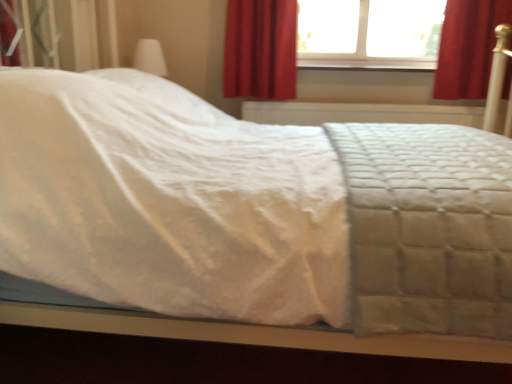
Question: Is the depth of red velvet curtain at upper right, the second curtain when ordered from left to right, less than that of white quilted fabric at center?

Choices:
 (A) no
 (B) yes

Answer: (A)

Question: Considering the relative sizes of red velvet curtain at upper right, the second curtain when ordered from left to right, and white quilted fabric at center in the image provided, is red velvet curtain at upper right, the second curtain when ordered from left to right, shorter than white quilted fabric at center?

Choices:
 (A) no
 (B) yes

Answer: (B)

Question: Is red velvet curtain at upper right, the 1th curtain when ordered from right to left, bigger than white quilted fabric at center?

Choices:
 (A) no
 (B) yes

Answer: (A)

Question: From a real-world perspective, is red velvet curtain at upper right, the second curtain when ordered from left to right, on top of white quilted fabric at center?

Choices:
 (A) no
 (B) yes

Answer: (B)

Question: Is red velvet curtain at upper right, the 1th curtain when ordered from right to left, outside of white quilted fabric at center?

Choices:
 (A) yes
 (B) no

Answer: (A)

Question: In terms of width, does transparent glass window at upper center look wider or thinner when compared to white quilted fabric at center?

Choices:
 (A) wide
 (B) thin

Answer: (B)

Question: From a real-world perspective, relative to white quilted fabric at center, is transparent glass window at upper center vertically above or below?

Choices:
 (A) above
 (B) below

Answer: (A)

Question: Is transparent glass window at upper center situated inside white quilted fabric at center or outside?

Choices:
 (A) outside
 (B) inside

Answer: (A)

Question: Would you say transparent glass window at upper center is to the left or to the right of white quilted fabric at center in the picture?

Choices:
 (A) right
 (B) left

Answer: (A)

Question: Considering the positions of red velvet curtain at upper right, the 1th curtain when ordered from right to left, and red velvet curtain at upper center, acting as the first curtain starting from the left, in the image, is red velvet curtain at upper right, the 1th curtain when ordered from right to left, bigger or smaller than red velvet curtain at upper center, acting as the first curtain starting from the left,?

Choices:
 (A) small
 (B) big

Answer: (B)

Question: Is red velvet curtain at upper right, the second curtain when ordered from left to right, wider or thinner than red velvet curtain at upper center, acting as the 2th curtain starting from the right?

Choices:
 (A) thin
 (B) wide

Answer: (A)

Question: From a real-world perspective, is red velvet curtain at upper right, the 1th curtain when ordered from right to left, physically located above or below red velvet curtain at upper center, acting as the first curtain starting from the left?

Choices:
 (A) above
 (B) below

Answer: (A)

Question: Is red velvet curtain at upper right, the 1th curtain when ordered from right to left, situated inside red velvet curtain at upper center, acting as the first curtain starting from the left, or outside?

Choices:
 (A) inside
 (B) outside

Answer: (B)

Question: In the image, is white quilted fabric at center on the left side or the right side of transparent glass window at upper center?

Choices:
 (A) right
 (B) left

Answer: (B)

Question: Based on their sizes in the image, would you say white quilted fabric at center is bigger or smaller than transparent glass window at upper center?

Choices:
 (A) big
 (B) small

Answer: (A)